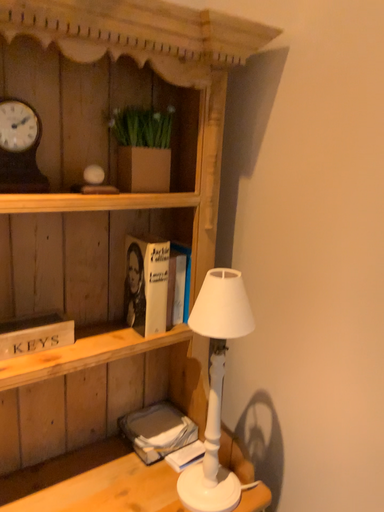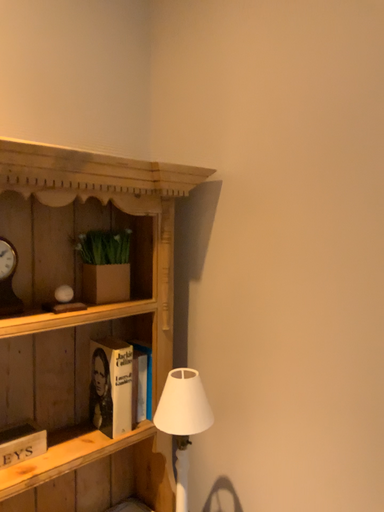
Question: How did the camera likely rotate when shooting the video?

Choices:
 (A) rotated upward
 (B) rotated downward

Answer: (A)